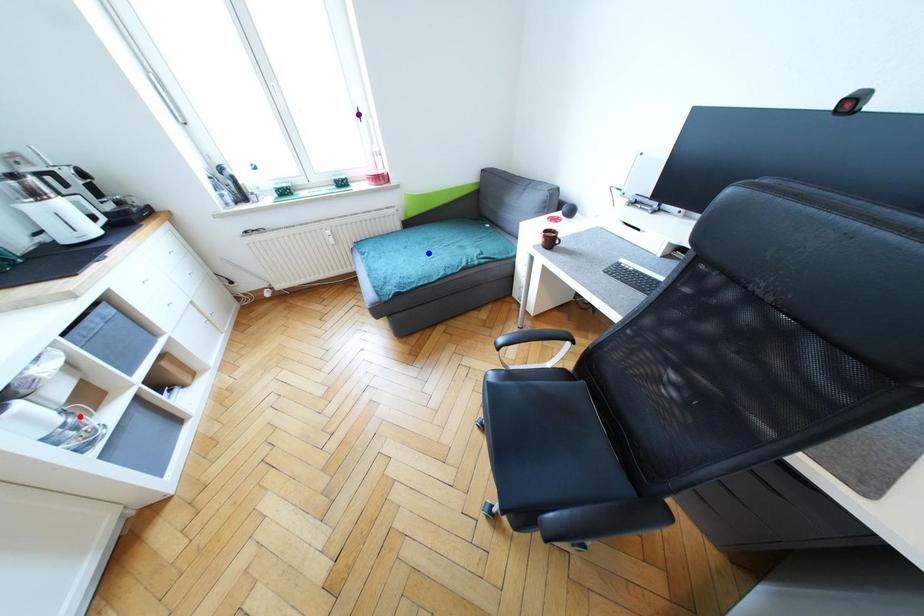
Order these from nearest to farthest:
- purple point
- red point
- blue point

red point
blue point
purple point